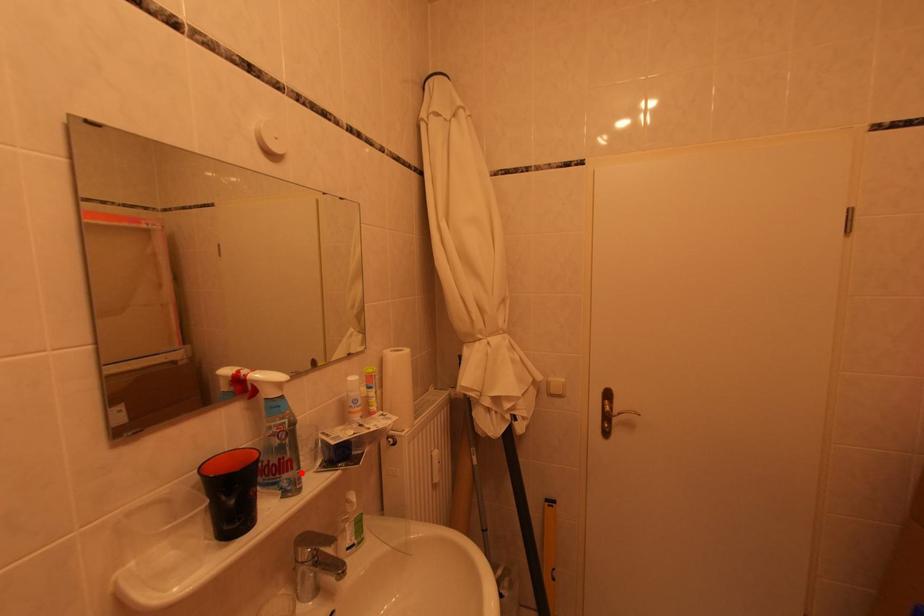
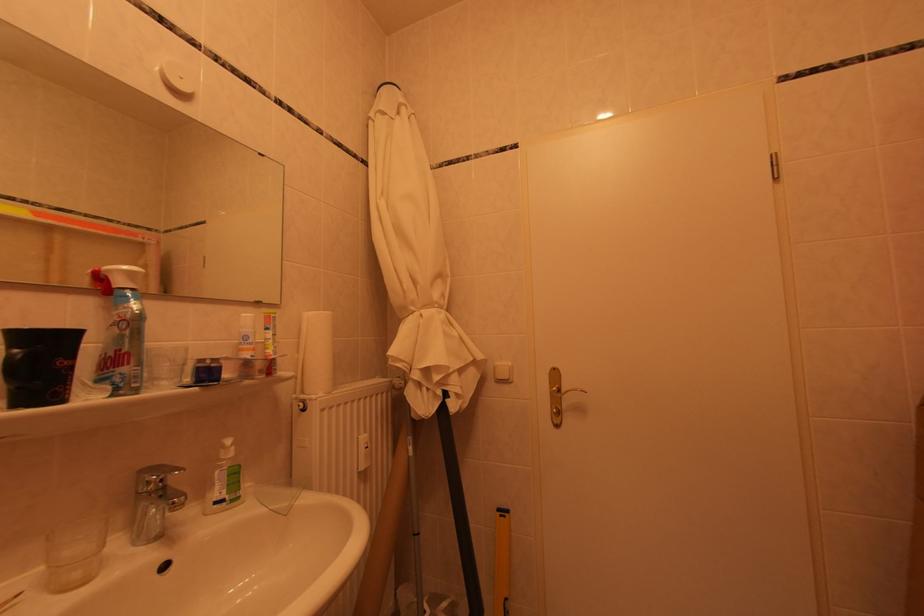
Locate, in the second image, the point that corresponds to the highlighted location in the first image.

(138, 368)